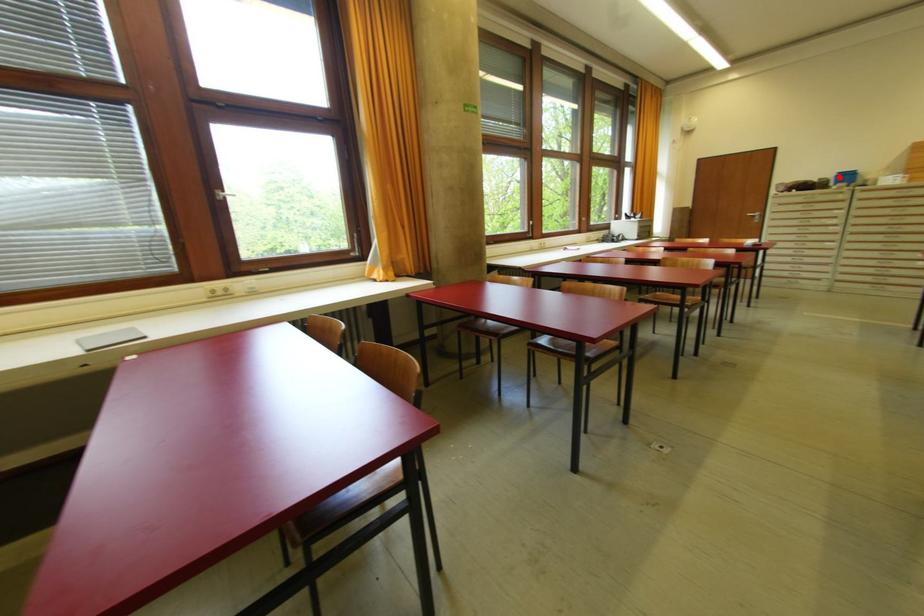
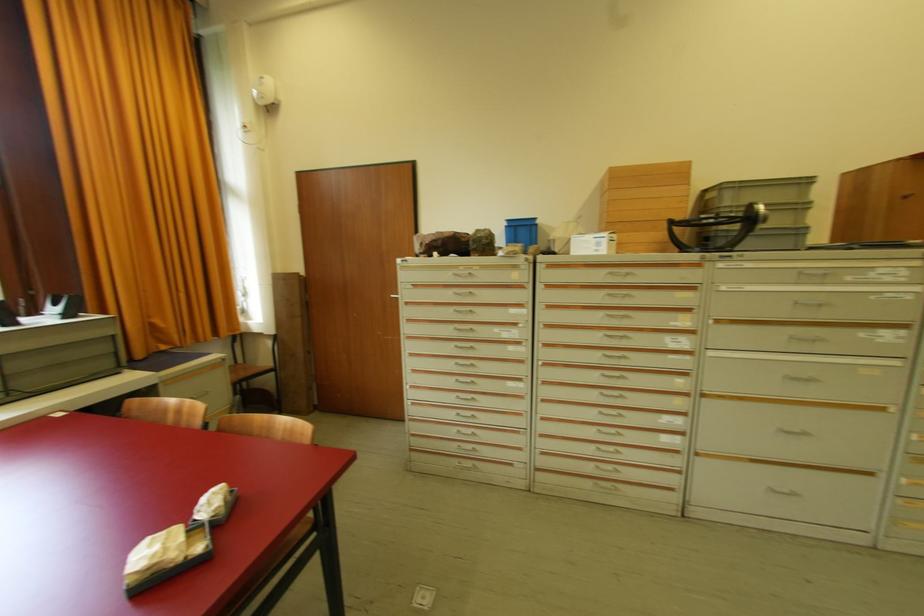
The point at the highlighted location is marked in the first image. Where is the corresponding point in the second image?

(508, 228)